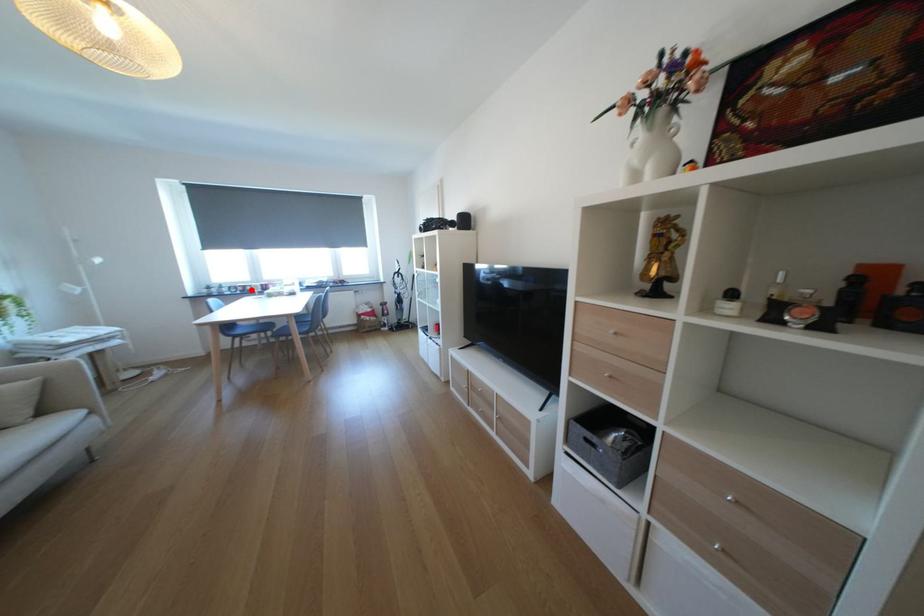
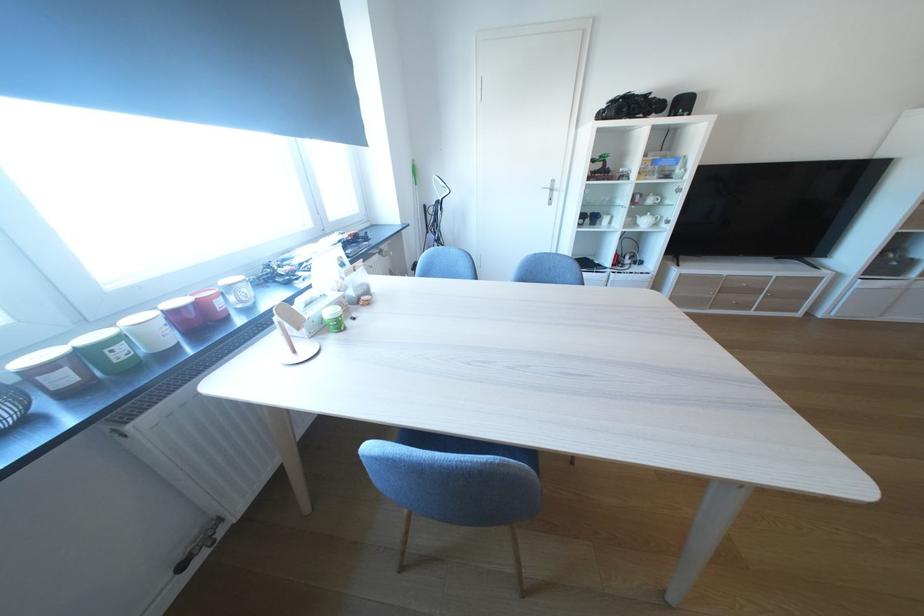
The point at the highlighted location is marked in the first image. Where is the corresponding point in the second image?

(75, 379)